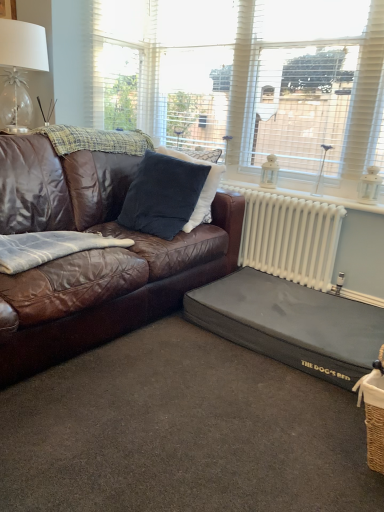
You are a GUI agent. You are given a task and a screenshot of the screen. Output one action in this format:
    pyautogui.click(x=<x>, y=<y>)
    Task: Click on the clear glass table lamp at upper left
    
    Given the screenshot: What is the action you would take?
    pyautogui.click(x=19, y=70)

What do you see at coordinates (19, 70) in the screenshot? I see `clear glass table lamp at upper left` at bounding box center [19, 70].

You are a GUI agent. You are given a task and a screenshot of the screen. Output one action in this format:
    pyautogui.click(x=<x>, y=<y>)
    Task: Click on the velvety dark blue pillow at center
    The height and width of the screenshot is (512, 384).
    Given the screenshot: What is the action you would take?
    pyautogui.click(x=162, y=195)

Is white textured window at upper center, positioned as the first window in right-to-left order, turned away from black fabric dog bed at lower right?

No, white textured window at upper center, positioned as the first window in right-to-left order, is not facing away from black fabric dog bed at lower right.

Is white textured window at upper center, positioned as the first window in right-to-left order, spatially inside black fabric dog bed at lower right, or outside of it?

white textured window at upper center, positioned as the first window in right-to-left order, exists outside the volume of black fabric dog bed at lower right.

Between point (360, 6) and point (260, 328), which one is positioned behind?

Point (360, 6)

Between black fabric dog bed at lower right and velvety dark blue pillow at center, which one has smaller size?

velvety dark blue pillow at center is smaller.

Which of these two, black fabric dog bed at lower right or velvety dark blue pillow at center, stands taller?

velvety dark blue pillow at center is taller.

Which is in front, black fabric dog bed at lower right or velvety dark blue pillow at center?

black fabric dog bed at lower right is closer to the camera.

Identify the location of the footrest in front of the velvety dark blue pillow at center. The image size is (384, 512). (291, 324).

Can we say clear glass table lamp at upper left lies outside black fabric dog bed at lower right?

Yes.

Considering the points (8, 33) and (285, 311), which point is in front, point (8, 33) or point (285, 311)?

The point (285, 311) is in front.

Which is more to the right, clear glass table lamp at upper left or white textured window at upper center, positioned as the first window in right-to-left order?

Positioned to the right is white textured window at upper center, positioned as the first window in right-to-left order.

From the picture: Is clear glass table lamp at upper left positioned with its back to white textured window at upper center, arranged as the second window when viewed from the left?

clear glass table lamp at upper left does not have its back to white textured window at upper center, arranged as the second window when viewed from the left.

Can you confirm if clear glass table lamp at upper left is shorter than white textured window at upper center, positioned as the first window in right-to-left order?

Correct, clear glass table lamp at upper left is not as tall as white textured window at upper center, positioned as the first window in right-to-left order.

Looking at this image, would you say clear glass table lamp at upper left is a long distance from white textured window at upper center, positioned as the first window in right-to-left order?

clear glass table lamp at upper left is positioned a significant distance from white textured window at upper center, positioned as the first window in right-to-left order.

Can you confirm if plaid woolen blanket at upper left, which is counted as the 2th blanket, starting from the bottom, is thinner than velvety dark blue pillow at center?

No, plaid woolen blanket at upper left, which is counted as the 2th blanket, starting from the bottom, is not thinner than velvety dark blue pillow at center.

Find the location of a particular element. The height and width of the screenshot is (512, 384). pillow below the plaid woolen blanket at upper left, which is counted as the 2th blanket, starting from the front (from the image's perspective) is located at coordinates (162, 195).

Is plaid woolen blanket at upper left, which is counted as the 2th blanket, starting from the bottom, not within velvety dark blue pillow at center?

plaid woolen blanket at upper left, which is counted as the 2th blanket, starting from the bottom, is positioned outside velvety dark blue pillow at center.

Based on the photo, from a real-world perspective, is plaid woolen blanket at upper left, which is counted as the 2th blanket, starting from the front, physically above velvety dark blue pillow at center?

Correct, in the physical world, plaid woolen blanket at upper left, which is counted as the 2th blanket, starting from the front, is higher than velvety dark blue pillow at center.

Would you say clear glass table lamp at upper left is part of white textured window at upper center, positioned as the first window in right-to-left order,'s contents?

No, clear glass table lamp at upper left is not a part of white textured window at upper center, positioned as the first window in right-to-left order.

Is white textured window at upper center, arranged as the second window when viewed from the left, bigger than clear glass table lamp at upper left?

Incorrect, white textured window at upper center, arranged as the second window when viewed from the left, is not larger than clear glass table lamp at upper left.

Can you see white textured window at upper center, arranged as the second window when viewed from the left, touching clear glass table lamp at upper left?

white textured window at upper center, arranged as the second window when viewed from the left, and clear glass table lamp at upper left are not in contact.

How different are the orientations of white textured window at upper center, positioned as the first window in right-to-left order, and clear glass table lamp at upper left in degrees?

The facing directions of white textured window at upper center, positioned as the first window in right-to-left order, and clear glass table lamp at upper left are 87.3 degrees apart.

Considering the points (42, 264) and (345, 58), which point is in front, point (42, 264) or point (345, 58)?

Point (42, 264)

Is denim fabric blanket at left, which ranks as the second blanket in top-to-bottom order, turned away from white textured window at upper center, positioned as the first window in right-to-left order?

No, denim fabric blanket at left, which ranks as the second blanket in top-to-bottom order, is not facing the opposite direction of white textured window at upper center, positioned as the first window in right-to-left order.

Based on the photo, does denim fabric blanket at left, which appears as the 2th blanket when viewed from the back, appear on the right side of white textured window at upper center, arranged as the second window when viewed from the left?

No, denim fabric blanket at left, which appears as the 2th blanket when viewed from the back, is not to the right of white textured window at upper center, arranged as the second window when viewed from the left.

Where is `footrest below the white textured window at upper center, positioned as the first window in right-to-left order (from the image's perspective)`? footrest below the white textured window at upper center, positioned as the first window in right-to-left order (from the image's perspective) is located at coordinates (291, 324).

This screenshot has width=384, height=512. Identify the location of pillow that appears above the black fabric dog bed at lower right (from a real-world perspective). (162, 195).

Looking at the image, which one is located further to plaid woolen blanket at upper left, which is counted as the 2th blanket, starting from the bottom, white textured window at upper center, which is counted as the first window, starting from the left, or denim fabric blanket at left, the first blanket positioned from the front?

The object further to plaid woolen blanket at upper left, which is counted as the 2th blanket, starting from the bottom, is white textured window at upper center, which is counted as the first window, starting from the left.

From the image, which object appears to be farther from plaid woolen blanket at upper left, which is counted as the 2th blanket, starting from the bottom, white metallic radiator at right or denim fabric blanket at left, which ranks as the 1th blanket in bottom-to-top order?

white metallic radiator at right is positioned further to the anchor plaid woolen blanket at upper left, which is counted as the 2th blanket, starting from the bottom.

Considering their positions, is velvety dark blue pillow at center positioned closer to black fabric dog bed at lower right than white textured window at upper center, marked as the 2th window in a right-to-left arrangement?

velvety dark blue pillow at center is positioned closer to the anchor black fabric dog bed at lower right.

Considering their positions, is white textured window at upper center, arranged as the second window when viewed from the left, positioned closer to black fabric dog bed at lower right than clear glass table lamp at upper left?

white textured window at upper center, arranged as the second window when viewed from the left.

Which object lies further to the anchor point denim fabric blanket at left, which appears as the 2th blanket when viewed from the back, velvety dark blue pillow at center or black fabric dog bed at lower right?

black fabric dog bed at lower right is further to denim fabric blanket at left, which appears as the 2th blanket when viewed from the back.

Which object lies nearer to the anchor point denim fabric blanket at left, which ranks as the second blanket in top-to-bottom order, white textured window at upper center, arranged as the second window when viewed from the left, or plaid woolen blanket at upper left, which is counted as the 2th blanket, starting from the front?

Among the two, plaid woolen blanket at upper left, which is counted as the 2th blanket, starting from the front, is located nearer to denim fabric blanket at left, which ranks as the second blanket in top-to-bottom order.

Which object lies nearer to the anchor point black fabric dog bed at lower right, white textured window at upper center, which is counted as the first window, starting from the left, or plaid woolen blanket at upper left, which is counted as the 2th blanket, starting from the front?

Based on the image, plaid woolen blanket at upper left, which is counted as the 2th blanket, starting from the front, appears to be nearer to black fabric dog bed at lower right.

Looking at this image, when comparing their distances from brown leather couch at left, does white metallic radiator at right or black fabric dog bed at lower right seem closer?

black fabric dog bed at lower right lies closer to brown leather couch at left than the other object.

The height and width of the screenshot is (512, 384). Identify the location of pillow that lies between white textured window at upper center, positioned as the first window in right-to-left order, and black fabric dog bed at lower right from top to bottom. (162, 195).

You are a GUI agent. You are given a task and a screenshot of the screen. Output one action in this format:
    pyautogui.click(x=<x>, y=<y>)
    Task: Click on the window between denim fabric blanket at left, which ranks as the second blanket in top-to-bottom order, and white metallic radiator at right from left to right
    
    Given the screenshot: What is the action you would take?
    pyautogui.click(x=247, y=78)

You are a GUI agent. You are given a task and a screenshot of the screen. Output one action in this format:
    pyautogui.click(x=<x>, y=<y>)
    Task: Click on the window between plaid woolen blanket at upper left, which is counted as the first blanket, starting from the top, and white textured window at upper center, arranged as the second window when viewed from the left
    The height and width of the screenshot is (512, 384).
    Given the screenshot: What is the action you would take?
    pyautogui.click(x=247, y=78)

Find the location of `window between clear glass table lamp at upper left and white metallic radiator at right in the horizontal direction`. window between clear glass table lamp at upper left and white metallic radiator at right in the horizontal direction is located at coordinates (247, 78).